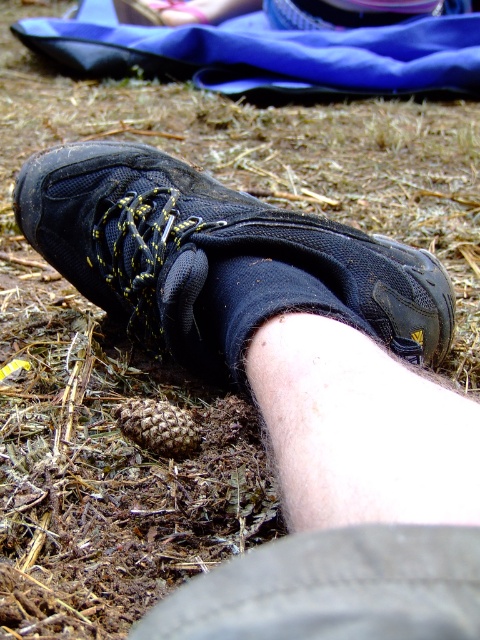
Question: Is matte black shoe at lower left thinner than black fabric ankle at lower center?

Choices:
 (A) yes
 (B) no

Answer: (B)

Question: Which object appears closest to the camera in this image?

Choices:
 (A) black fabric ankle at lower center
 (B) matte black shoe at lower left

Answer: (A)

Question: Which of the following is the farthest from the observer?

Choices:
 (A) black fabric ankle at lower center
 (B) matte black shoe at lower left

Answer: (B)

Question: Does matte black shoe at lower left appear over black fabric ankle at lower center?

Choices:
 (A) no
 (B) yes

Answer: (B)

Question: Among these objects, which one is farthest from the camera?

Choices:
 (A) black fabric ankle at lower center
 (B) matte black shoe at lower left

Answer: (B)

Question: Is matte black shoe at lower left wider than black fabric ankle at lower center?

Choices:
 (A) no
 (B) yes

Answer: (B)